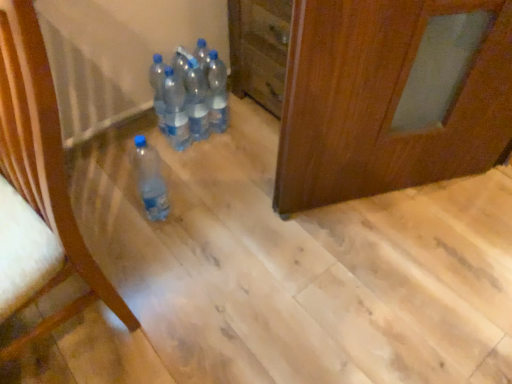
Question: Is translucent plastic bottle at lower left, acting as the 4th bottle starting from the right, looking in the opposite direction of translucent plastic bottles at center, placed as the fourth bottle when sorted from left to right?

Choices:
 (A) no
 (B) yes

Answer: (A)

Question: Can you confirm if translucent plastic bottle at lower left, acting as the 4th bottle starting from the right, is taller than translucent plastic bottles at center, placed as the fourth bottle when sorted from left to right?

Choices:
 (A) no
 (B) yes

Answer: (A)

Question: Does translucent plastic bottle at lower left, acting as the 4th bottle starting from the right, lie behind translucent plastic bottles at center, placed as the 2th bottle when sorted from right to left?

Choices:
 (A) no
 (B) yes

Answer: (A)

Question: From a real-world perspective, is translucent plastic bottle at lower left, acting as the 4th bottle starting from the right, over translucent plastic bottles at center, placed as the fourth bottle when sorted from left to right?

Choices:
 (A) no
 (B) yes

Answer: (A)

Question: Are translucent plastic bottle at lower left, acting as the 4th bottle starting from the right, and translucent plastic bottles at center, placed as the fourth bottle when sorted from left to right, located far from each other?

Choices:
 (A) yes
 (B) no

Answer: (B)

Question: Is clear plastic bottle at left bigger or smaller than transparent plastic bottles at center, the first bottle positioned from the right?

Choices:
 (A) big
 (B) small

Answer: (A)

Question: In terms of width, does clear plastic bottle at left look wider or thinner when compared to transparent plastic bottles at center, the first bottle positioned from the right?

Choices:
 (A) wide
 (B) thin

Answer: (A)

Question: Do you think clear plastic bottle at left is within transparent plastic bottles at center, placed as the 5th bottle when sorted from left to right, or outside of it?

Choices:
 (A) inside
 (B) outside

Answer: (B)

Question: Is point (13, 254) positioned closer to the camera than point (215, 117)?

Choices:
 (A) closer
 (B) farther

Answer: (A)

Question: From a real-world perspective, relative to transparent plastic bottles at center, the 3th bottle in the right-to-left sequence, is transparent plastic bottles at center, placed as the 5th bottle when sorted from left to right, vertically above or below?

Choices:
 (A) above
 (B) below

Answer: (A)

Question: Do you think transparent plastic bottles at center, placed as the 5th bottle when sorted from left to right, is within transparent plastic bottles at center, the third bottle positioned from the left, or outside of it?

Choices:
 (A) inside
 (B) outside

Answer: (B)

Question: From the image's perspective, is transparent plastic bottles at center, placed as the 5th bottle when sorted from left to right, above or below transparent plastic bottles at center, the third bottle positioned from the left?

Choices:
 (A) above
 (B) below

Answer: (A)

Question: Considering the positions of point (208, 91) and point (181, 145), is point (208, 91) closer or farther from the camera than point (181, 145)?

Choices:
 (A) closer
 (B) farther

Answer: (A)

Question: Is point (12, 311) positioned closer to the camera than point (162, 109)?

Choices:
 (A) farther
 (B) closer

Answer: (B)

Question: In the image, is clear plastic bottle at left on the left side or the right side of transparent plastic bottles at center, which appears as the 1th bottle when viewed from the left?

Choices:
 (A) right
 (B) left

Answer: (B)